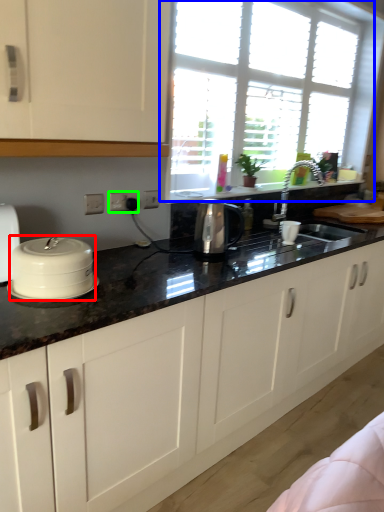
Question: Which object is positioned closest to home appliance (highlighted by a red box)? Select from window (highlighted by a blue box) and electric outlet (highlighted by a green box).

Choices:
 (A) window
 (B) electric outlet

Answer: (B)